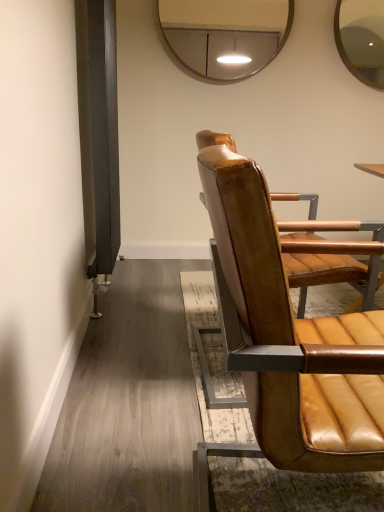
Question: From the image's perspective, is leather seat at right located beneath metallic silver mirror at upper center?

Choices:
 (A) yes
 (B) no

Answer: (A)

Question: From the image's perspective, is leather seat at right on top of metallic silver mirror at upper center?

Choices:
 (A) no
 (B) yes

Answer: (A)

Question: Is leather seat at right thinner than metallic silver mirror at upper center?

Choices:
 (A) no
 (B) yes

Answer: (A)

Question: Is leather seat at right at the right side of metallic silver mirror at upper center?

Choices:
 (A) no
 (B) yes

Answer: (B)

Question: Is leather seat at right bigger than metallic silver mirror at upper center?

Choices:
 (A) no
 (B) yes

Answer: (B)

Question: Does leather seat at right have a smaller size compared to metallic silver mirror at upper center?

Choices:
 (A) no
 (B) yes

Answer: (A)

Question: From the image's perspective, would you say metallic silver mirror at upper center is shown under leather seat at right?

Choices:
 (A) no
 (B) yes

Answer: (A)

Question: From the image's perspective, is metallic silver mirror at upper center over leather seat at right?

Choices:
 (A) yes
 (B) no

Answer: (A)

Question: Considering the relative sizes of metallic silver mirror at upper center and leather seat at right in the image provided, is metallic silver mirror at upper center bigger than leather seat at right?

Choices:
 (A) yes
 (B) no

Answer: (B)

Question: Is metallic silver mirror at upper center surrounding leather seat at right?

Choices:
 (A) no
 (B) yes

Answer: (A)

Question: Is metallic silver mirror at upper center smaller than leather seat at right?

Choices:
 (A) no
 (B) yes

Answer: (B)

Question: From a real-world perspective, does metallic silver mirror at upper center sit lower than leather seat at right?

Choices:
 (A) no
 (B) yes

Answer: (A)

Question: Looking at the image, does leather seat at right seem bigger or smaller compared to metallic silver mirror at upper center?

Choices:
 (A) big
 (B) small

Answer: (A)